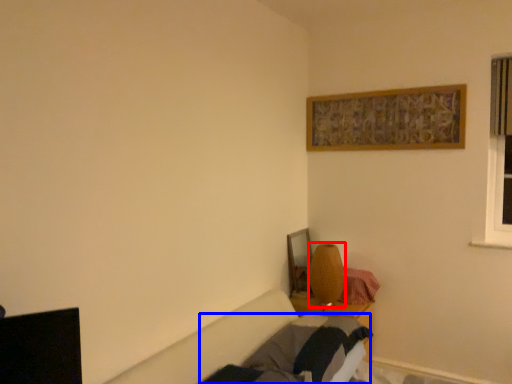
Question: Which object is further to the camera taking this photo, table lamp (highlighted by a red box) or bed frame (highlighted by a blue box)?

Choices:
 (A) table lamp
 (B) bed frame

Answer: (A)